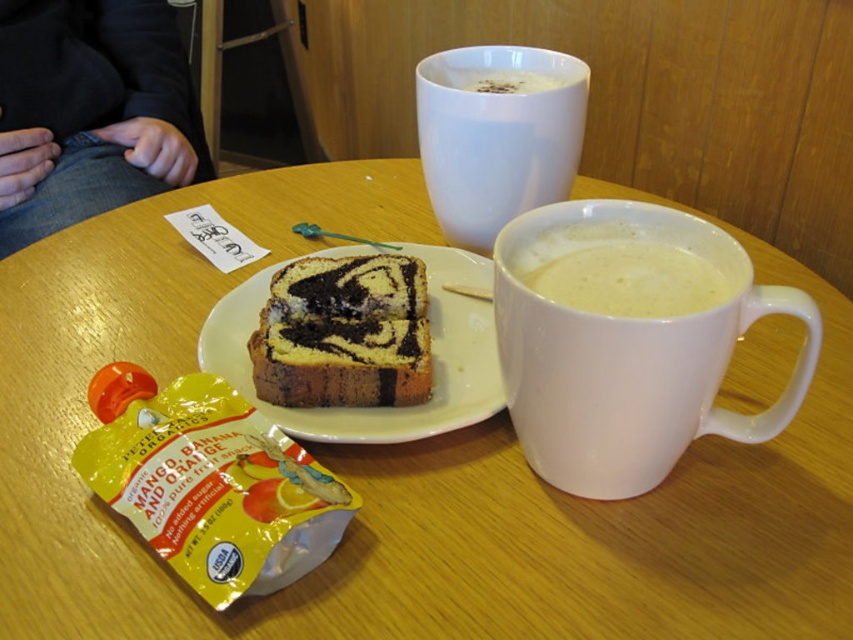
In the scene shown: You are sitting at the wooden table in the cozy cafe and want to reach both points on the table. Which point, point (430, 179) or point (584, 307), is closer to you?

Point (430, 179) is closer to you because it is further to the viewer than point (584, 307).

Looking at this image, you are a barista who needs to place a new cup of tea between the white glossy mug at upper center and the white matte mug at right. Can you fit it there without moving either mug?

The white glossy mug at upper center is in front of the white matte mug at right, so there is space between them where you can place the new cup of tea without moving either mug.

You are a customer at the cafe and want to grab the white matte mug at right and the white frothy coffee at upper center. Which one is closer to your right hand if you are sitting facing the table?

The white matte mug at right is to the right of the white frothy coffee at upper center, so it is closer to your right hand.